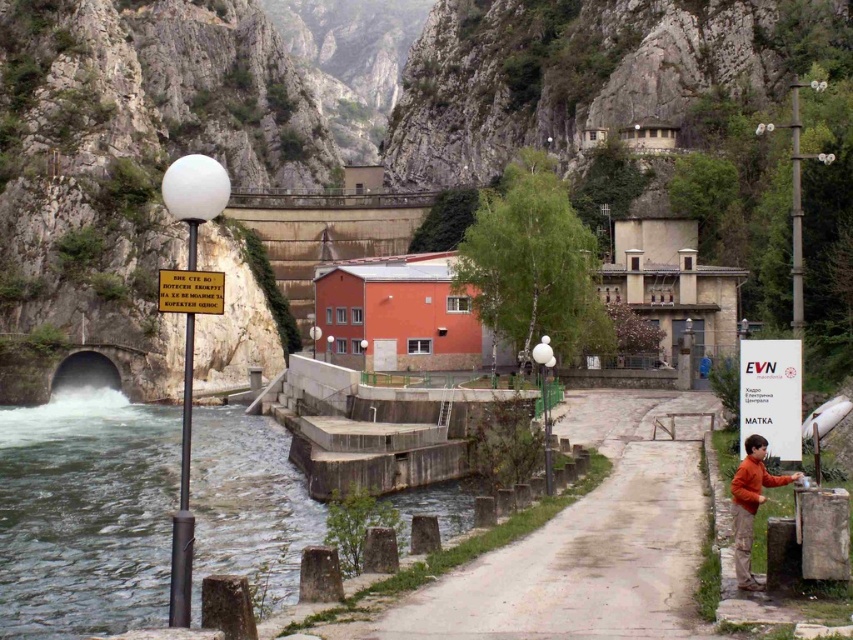
Which is below, gray concrete path at center or orange cotton shirt at lower right?

gray concrete path at center is below.

Find the location of a particular element. gray concrete path at center is located at coordinates (589, 544).

Where is `gray concrete path at center`? The width and height of the screenshot is (853, 640). gray concrete path at center is located at coordinates click(589, 544).